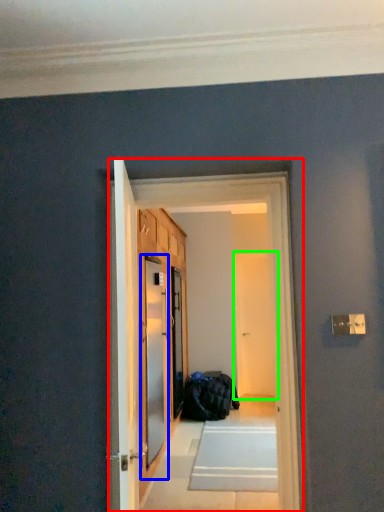
Question: Which object is positioned closest to corridor (highlighted by a red box)? Select from screen door (highlighted by a blue box) and screen door (highlighted by a green box).

Choices:
 (A) screen door
 (B) screen door

Answer: (A)